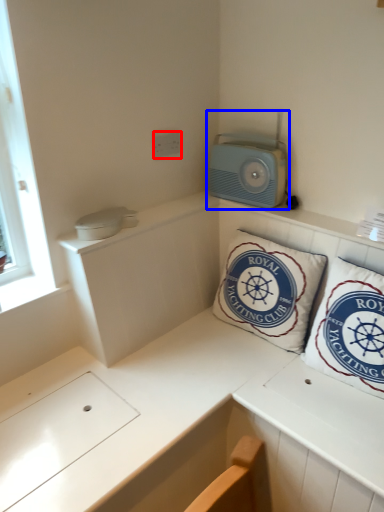
Question: Which point is closer to the camera, electric outlet (highlighted by a red box) or appliance (highlighted by a blue box)?

Choices:
 (A) electric outlet
 (B) appliance

Answer: (B)